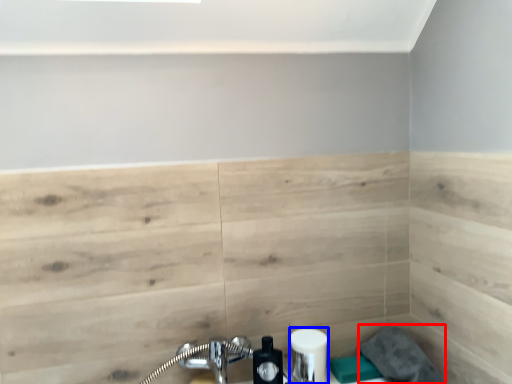
Question: Which object is closer to the camera taking this photo, gray (highlighted by a red box) or toiletry (highlighted by a blue box)?

Choices:
 (A) gray
 (B) toiletry

Answer: (A)